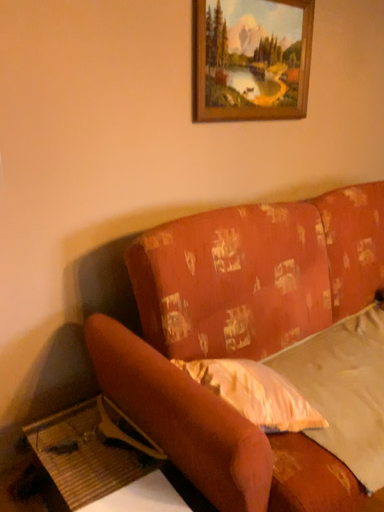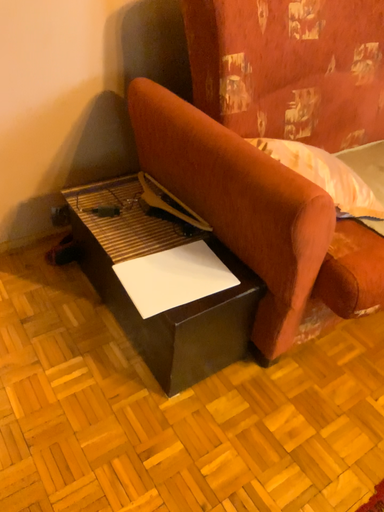
Question: How did the camera likely rotate when shooting the video?

Choices:
 (A) rotated upward
 (B) rotated downward

Answer: (B)